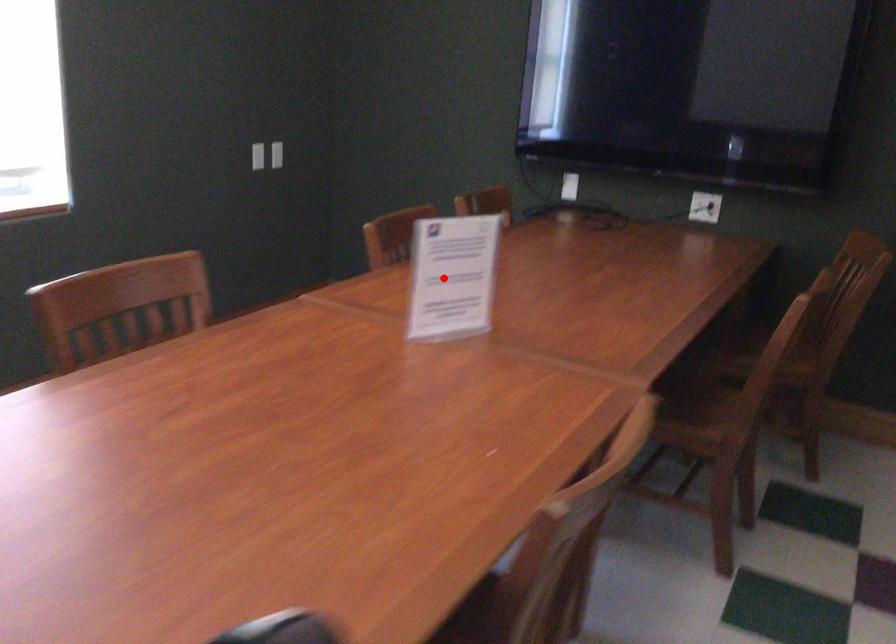
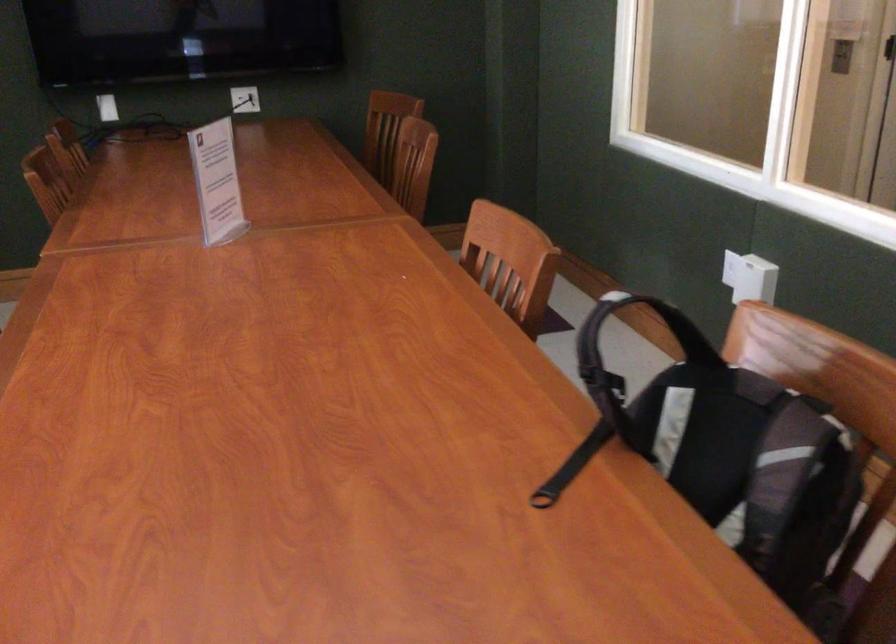
Where in the second image is the point corresponding to the highlighted location from the first image?

(217, 182)